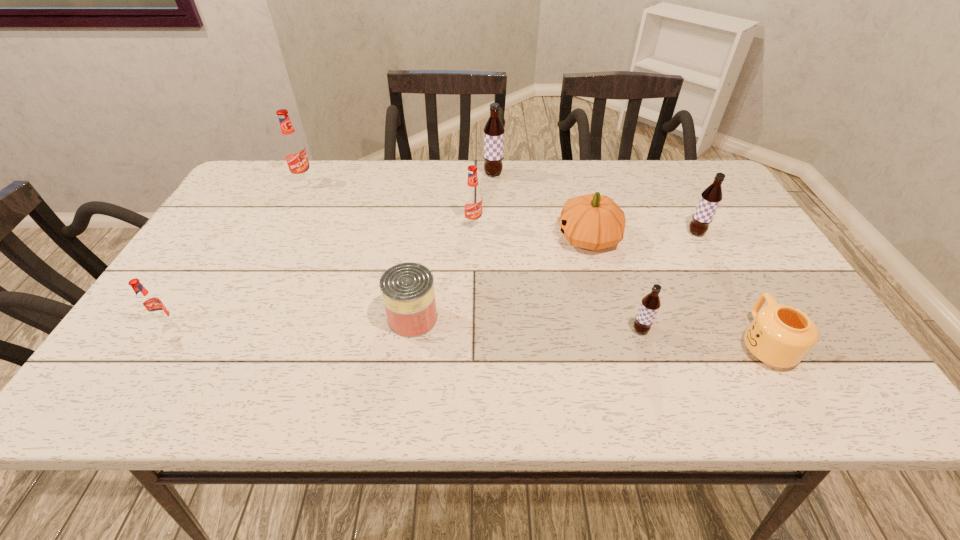
Where is `red root beer that can be found as the closest to the orange gourd`? Image resolution: width=960 pixels, height=540 pixels. red root beer that can be found as the closest to the orange gourd is located at coordinates (472, 197).

At what (x,y) coordinates should I click in order to perform the action: click on red root beer that is the closest to the fifth object from right to left. Please return your answer as a coordinate pair (x, y). Looking at the image, I should click on (472, 197).

You are a GUI agent. You are given a task and a screenshot of the screen. Output one action in this format:
    pyautogui.click(x=<x>, y=<y>)
    Task: Click on the vacant position in the image that satisfies the following two spatial constraints: 1. on the front side of the second biggest red root beer; 2. on the left side of the second smallest brown root beer
    This screenshot has width=960, height=540.
    Given the screenshot: What is the action you would take?
    pyautogui.click(x=473, y=233)

The image size is (960, 540). I want to click on free location that satisfies the following two spatial constraints: 1. on the back side of the rightmost brown root beer; 2. on the left side of the nearest brown root beer, so click(x=609, y=233).

I want to click on vacant area in the image that satisfies the following two spatial constraints: 1. on the front side of the eighth object from right to left; 2. on the right side of the nearest brown root beer, so click(228, 330).